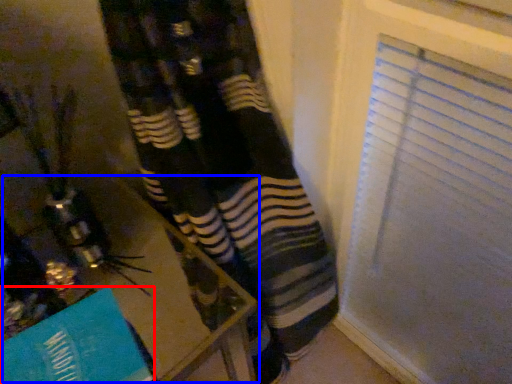
Question: Which point is further to the camera, paperback book (highlighted by a red box) or table (highlighted by a blue box)?

Choices:
 (A) paperback book
 (B) table

Answer: (B)